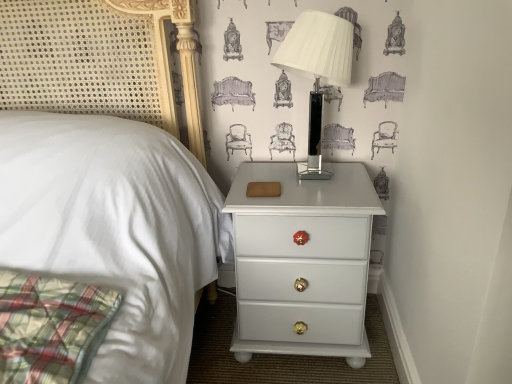
Where is `white glossy nightstand at lower right`? This screenshot has height=384, width=512. white glossy nightstand at lower right is located at coordinates (302, 262).

Describe the element at coordinates (302, 262) in the screenshot. The height and width of the screenshot is (384, 512). I see `white glossy nightstand at lower right` at that location.

What do you see at coordinates (317, 71) in the screenshot?
I see `white glossy table lamp at upper right` at bounding box center [317, 71].

The width and height of the screenshot is (512, 384). Identify the location of white glossy table lamp at upper right. (317, 71).

You are a GUI agent. You are given a task and a screenshot of the screen. Output one action in this format:
    pyautogui.click(x=<x>, y=<y>)
    Task: Click on the white glossy nightstand at lower right
    This screenshot has width=512, height=384.
    Given the screenshot: What is the action you would take?
    pyautogui.click(x=302, y=262)

Which is more to the left, white glossy table lamp at upper right or white glossy nightstand at lower right?

white glossy nightstand at lower right is more to the left.

Between white glossy table lamp at upper right and white glossy nightstand at lower right, which one is positioned in front?

Positioned in front is white glossy table lamp at upper right.

Which is behind, point (343, 40) or point (260, 343)?

The point (260, 343) is behind.

Based on the photo, from the image's perspective, is white glossy table lamp at upper right located beneath white glossy nightstand at lower right?

Actually, white glossy table lamp at upper right appears above white glossy nightstand at lower right in the image.

From a real-world perspective, is white glossy table lamp at upper right positioned under white glossy nightstand at lower right based on gravity?

No, from a real-world perspective, white glossy table lamp at upper right is not under white glossy nightstand at lower right.

Consider the image. Which of these two, white glossy table lamp at upper right or white glossy nightstand at lower right, is thinner?

white glossy table lamp at upper right.

Looking at this image, considering the relative sizes of white glossy table lamp at upper right and white glossy nightstand at lower right in the image provided, is white glossy table lamp at upper right taller than white glossy nightstand at lower right?

Incorrect, the height of white glossy table lamp at upper right is not larger of that of white glossy nightstand at lower right.

Which of these two, white glossy table lamp at upper right or white glossy nightstand at lower right, is smaller?

A: Smaller between the two is white glossy table lamp at upper right.

Is white glossy nightstand at lower right completely or partially inside white glossy table lamp at upper right?

Definitely not — white glossy nightstand at lower right is not inside white glossy table lamp at upper right.

Are white glossy table lamp at upper right and white glossy nightstand at lower right far apart?

Actually, white glossy table lamp at upper right and white glossy nightstand at lower right are a little close together.

Consider the image. Could you tell me if white glossy table lamp at upper right is turned towards white glossy nightstand at lower right?

No, white glossy table lamp at upper right is not turned towards white glossy nightstand at lower right.

What's the angular difference between white glossy table lamp at upper right and white glossy nightstand at lower right's facing directions?

The angular difference between white glossy table lamp at upper right and white glossy nightstand at lower right is 3.83 degrees.

The width and height of the screenshot is (512, 384). In order to click on table lamp that is above the white glossy nightstand at lower right (from the image's perspective) in this screenshot , I will do `click(317, 71)`.

In the scene shown: Visually, is white glossy nightstand at lower right positioned to the left or to the right of white glossy table lamp at upper right?

Clearly, white glossy nightstand at lower right is on the left of white glossy table lamp at upper right in the image.

Is white glossy nightstand at lower right positioned behind white glossy table lamp at upper right?

Yes.

Is point (252, 324) closer or farther from the camera than point (334, 15)?

Point (252, 324) is farther from the camera than point (334, 15).

From the image's perspective, is white glossy nightstand at lower right beneath white glossy table lamp at upper right?

Yes, from the image's perspective, white glossy nightstand at lower right is below white glossy table lamp at upper right.

From a real-world perspective, is white glossy nightstand at lower right on top of white glossy table lamp at upper right?

Incorrect, from a real-world perspective, white glossy nightstand at lower right is lower than white glossy table lamp at upper right.

Which of these two, white glossy nightstand at lower right or white glossy table lamp at upper right, is wider?

white glossy nightstand at lower right is wider.

Which of these two, white glossy nightstand at lower right or white glossy table lamp at upper right, stands taller?

Standing taller between the two is white glossy nightstand at lower right.

Considering the relative sizes of white glossy nightstand at lower right and white glossy table lamp at upper right in the image provided, is white glossy nightstand at lower right smaller than white glossy table lamp at upper right?

No, white glossy nightstand at lower right is not smaller than white glossy table lamp at upper right.

Could white glossy table lamp at upper right be considered to be inside white glossy nightstand at lower right?

No, white glossy table lamp at upper right is not inside white glossy nightstand at lower right.

Is the surface of white glossy nightstand at lower right in direct contact with white glossy table lamp at upper right?

white glossy nightstand at lower right is not next to white glossy table lamp at upper right, and they're not touching.

Is white glossy nightstand at lower right aimed at white glossy table lamp at upper right?

No, white glossy nightstand at lower right is not facing towards white glossy table lamp at upper right.

From the picture: How different are the orientations of white glossy nightstand at lower right and white glossy table lamp at upper right in degrees?

The angular difference between white glossy nightstand at lower right and white glossy table lamp at upper right is 3.83 degrees.

At what (x,y) coordinates should I click in order to perform the action: click on nightstand directly beneath the white glossy table lamp at upper right (from a real-world perspective). Please return your answer as a coordinate pair (x, y). Looking at the image, I should click on (302, 262).

This screenshot has width=512, height=384. I want to click on table lamp above the white glossy nightstand at lower right (from a real-world perspective), so click(x=317, y=71).

Find the location of a particular element. table lamp on the right of white glossy nightstand at lower right is located at coordinates (317, 71).